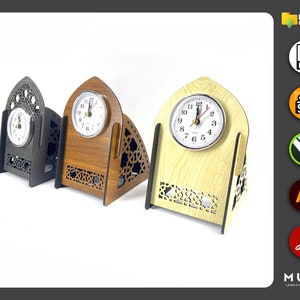
Identify the location of 3 clocks. (19, 154), (78, 147), (186, 174).